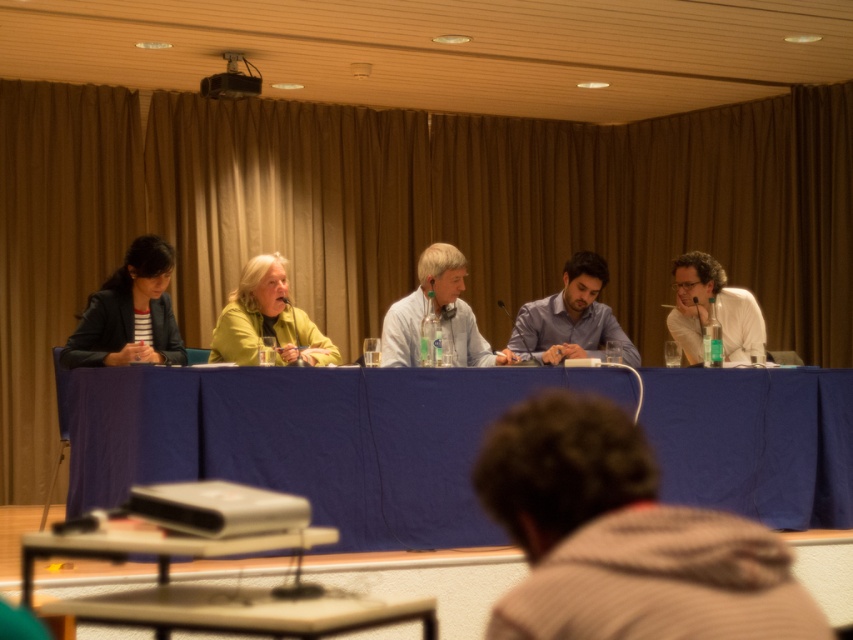
Which of these two, light beige shirt at center or matte black glasses at right, stands taller?

With more height is matte black glasses at right.

You are a GUI agent. You are given a task and a screenshot of the screen. Output one action in this format:
    pyautogui.click(x=<x>, y=<y>)
    Task: Click on the light beige shirt at center
    The width and height of the screenshot is (853, 640).
    Given the screenshot: What is the action you would take?
    pyautogui.click(x=439, y=314)

Is brown cotton hoodie at lower center thinner than light beige shirt at center?

Yes.

This screenshot has width=853, height=640. What do you see at coordinates (622, 538) in the screenshot? I see `brown cotton hoodie at lower center` at bounding box center [622, 538].

What do you see at coordinates (622, 538) in the screenshot? I see `brown cotton hoodie at lower center` at bounding box center [622, 538].

Where is `brown cotton hoodie at lower center`? This screenshot has width=853, height=640. brown cotton hoodie at lower center is located at coordinates (622, 538).

Can you confirm if blue fabric table at center is shorter than matte black blazer at left?

No.

Can you confirm if blue fabric table at center is positioned above matte black blazer at left?

No.

Does point (242, 474) come in front of point (103, 339)?

Yes, it is.

The width and height of the screenshot is (853, 640). What are the coordinates of `blue fabric table at center` in the screenshot? It's located at (312, 440).